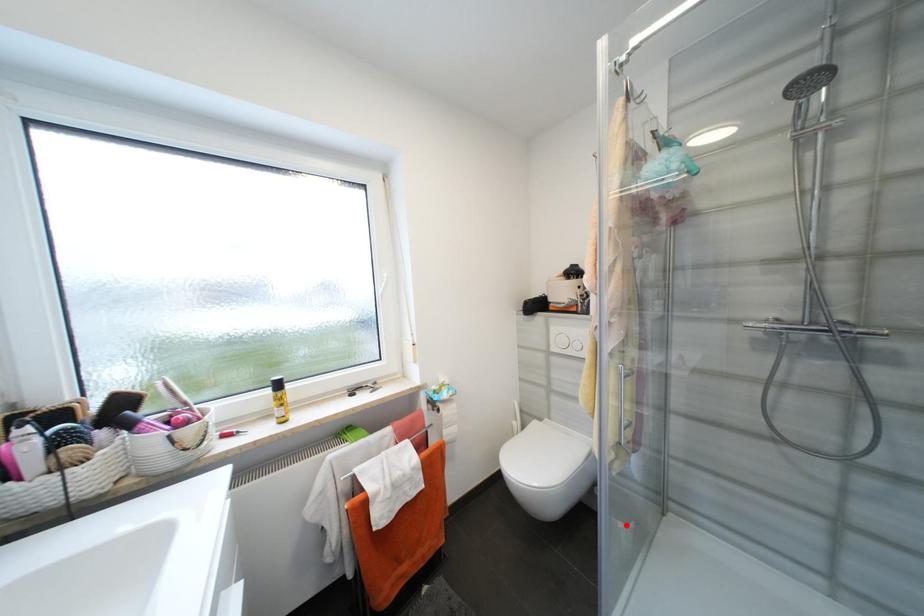
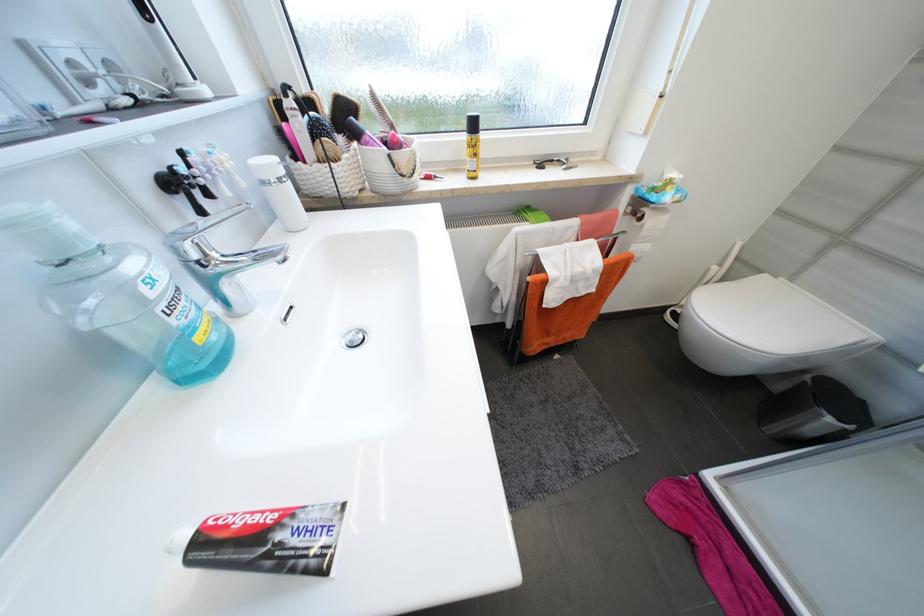
In the second image, find the point that corresponds to the highlighted location in the first image.

(834, 421)